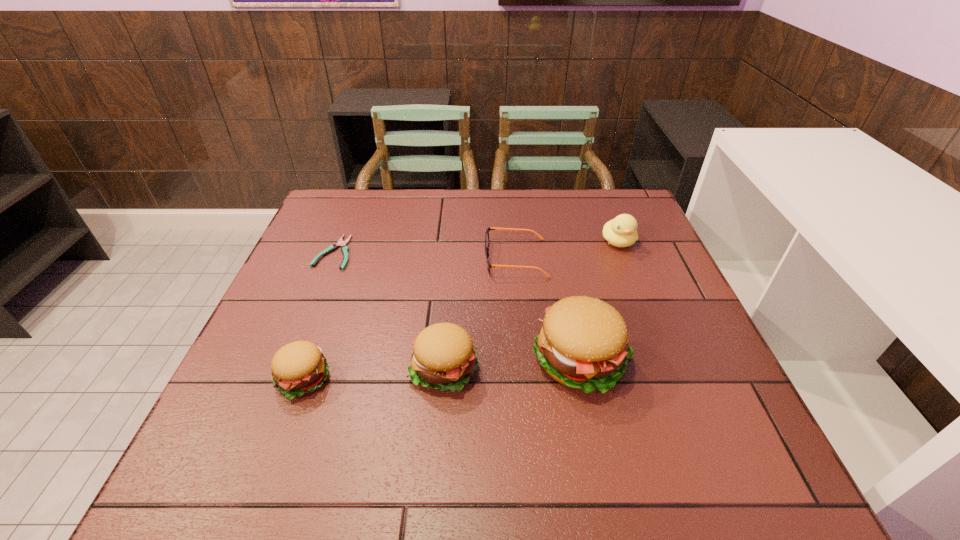
Locate which hamburger ranks second in proximity to the rightmost object. Please provide its 2D coordinates. Your answer should be formatted as a tuple, i.e. [(x, y)], where the tuple contains the x and y coordinates of a point satisfying the conditions above.

[(443, 357)]

Where is `free space that satisfies the following two spatial constraints: 1. at the beak of the rightmost object; 2. on the front-facing side of the fifth tallest object`? The width and height of the screenshot is (960, 540). free space that satisfies the following two spatial constraints: 1. at the beak of the rightmost object; 2. on the front-facing side of the fifth tallest object is located at coordinates (625, 258).

This screenshot has width=960, height=540. Identify the location of vacant space that satisfies the following two spatial constraints: 1. on the front-facing side of the rightmost hamburger; 2. on the right side of the fifth tallest object. (525, 359).

Where is `vacant area that satisfies the following two spatial constraints: 1. at the beak of the rightmost object; 2. on the front-facing side of the spectacles`? This screenshot has height=540, width=960. vacant area that satisfies the following two spatial constraints: 1. at the beak of the rightmost object; 2. on the front-facing side of the spectacles is located at coordinates (625, 258).

This screenshot has height=540, width=960. Find the location of `free space that satisfies the following two spatial constraints: 1. at the beak of the duckling; 2. on the front-facing side of the fifth tallest object`. free space that satisfies the following two spatial constraints: 1. at the beak of the duckling; 2. on the front-facing side of the fifth tallest object is located at coordinates [625, 258].